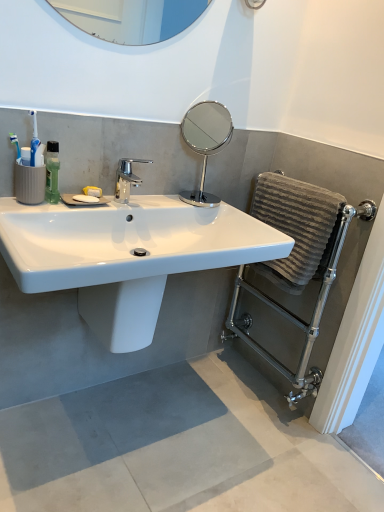
Question: From the image's perspective, relative to gray concrete floor at lower center, is polished chrome tap at center above or below?

Choices:
 (A) below
 (B) above

Answer: (B)

Question: Considering the positions of point (129, 166) and point (105, 500), is point (129, 166) closer or farther from the camera than point (105, 500)?

Choices:
 (A) farther
 (B) closer

Answer: (A)

Question: Which is farther from the white glossy sink at center?

Choices:
 (A) polished chrome tap at center
 (B) gray textured towel at right
 (C) polished chrome mirror at center
 (D) white glossy bidet at center
 (E) green matte bottle at left

Answer: (C)

Question: Estimate the real-world distances between objects in this image. Which object is closer to the white glossy sink at center?

Choices:
 (A) polished chrome tap at center
 (B) green matte bottle at left
 (C) gray concrete floor at lower center
 (D) polished chrome mirror at center
 (E) white glossy bidet at center

Answer: (E)